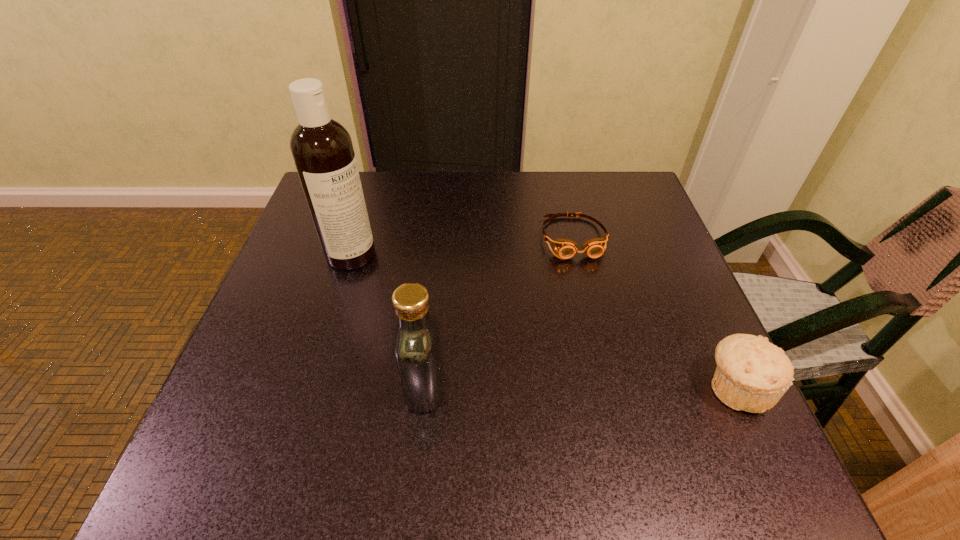
In the image, there is a desktop. Identify the location of free space at the far left corner. The image size is (960, 540). (310, 221).

Locate an element on the screen. The image size is (960, 540). vacant space at the far right corner of the desktop is located at coordinates (630, 178).

Identify the location of blank space at the near right corner. (674, 411).

I want to click on vacant area that lies between the third tallest object and the vodka, so click(x=580, y=387).

Image resolution: width=960 pixels, height=540 pixels. In order to click on empty location between the third object from right to left and the leftmost object in this screenshot , I will do tap(388, 321).

This screenshot has height=540, width=960. Find the location of `vacant area between the third shortest object and the third object from left to right`. vacant area between the third shortest object and the third object from left to right is located at coordinates (499, 312).

This screenshot has width=960, height=540. In order to click on vacant area that lies between the rightmost object and the shortest object in this screenshot , I will do `click(655, 313)`.

The width and height of the screenshot is (960, 540). Identify the location of free space between the dishwasher detergent and the second object from right to left. tap(462, 246).

Identify the location of free space between the vodka and the leftmost object. The height and width of the screenshot is (540, 960). (388, 321).

The image size is (960, 540). Find the location of `vacant space that's between the leftmost object and the vodka`. vacant space that's between the leftmost object and the vodka is located at coordinates (388, 321).